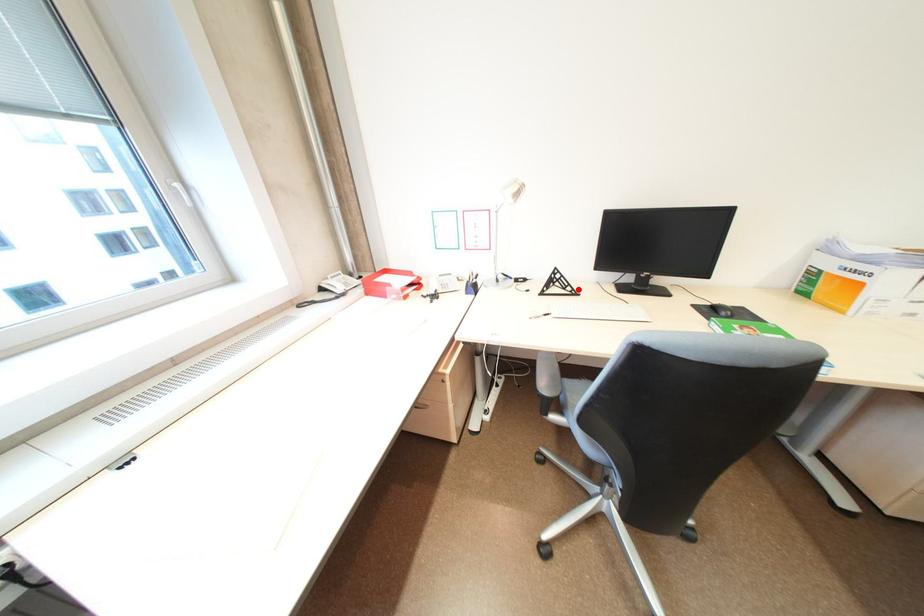
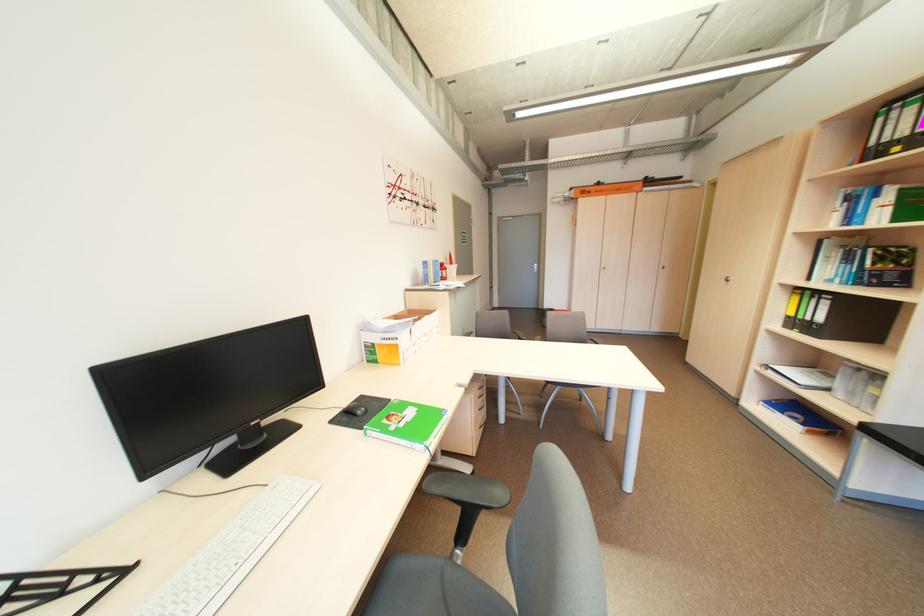
The point at the highlighted location is marked in the first image. Where is the corresponding point in the second image?

(91, 582)